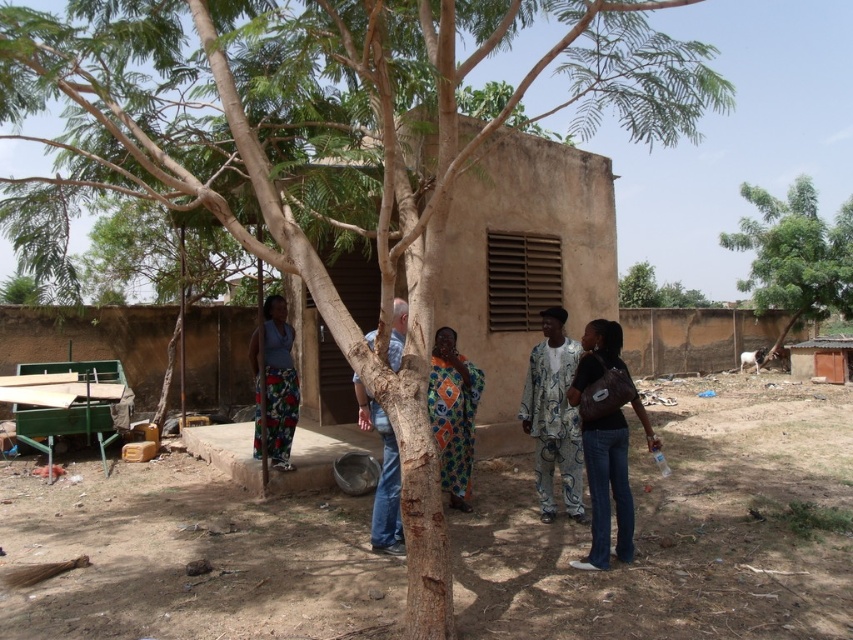
Question: Can you confirm if brown dirt field at lower center is thinner than dark brown leather handbag at lower right?

Choices:
 (A) no
 (B) yes

Answer: (A)

Question: Is printed fabric shirt at center to the left of floral pants at center from the viewer's perspective?

Choices:
 (A) no
 (B) yes

Answer: (A)

Question: Among these points, which one is farthest from the camera?

Choices:
 (A) (363, 397)
 (B) (282, 371)
 (C) (461, 452)

Answer: (B)

Question: Which of the following is the farthest from the observer?

Choices:
 (A) (546, 596)
 (B) (845, 317)

Answer: (B)

Question: Which of the following is the closest to the observer?

Choices:
 (A) (543, 404)
 (B) (451, 454)
 (C) (741, 192)
 (D) (328, 529)

Answer: (D)

Question: Is printed fabric shirt at center further to the viewer compared to blue jeans at center?

Choices:
 (A) yes
 (B) no

Answer: (A)